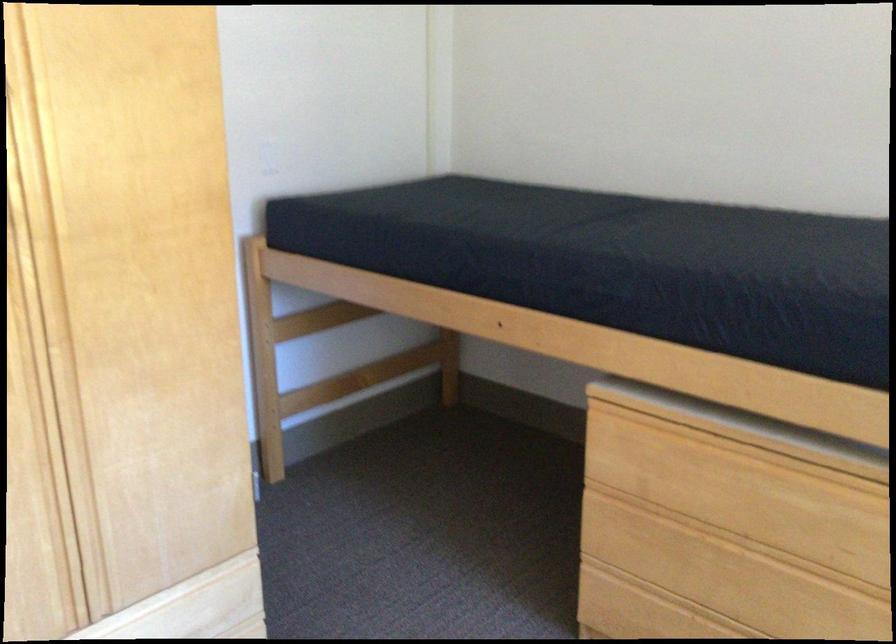
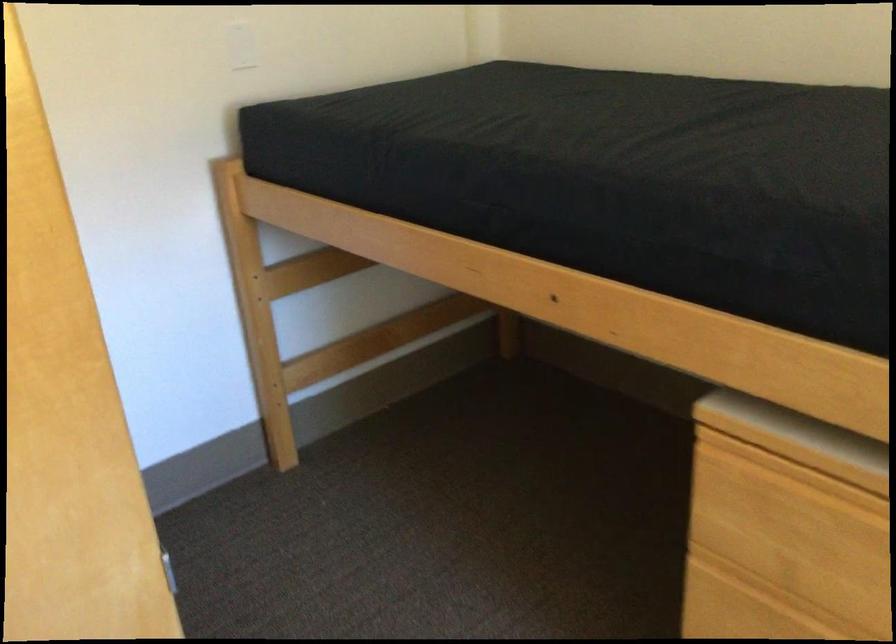
The point at (304, 323) is marked in the first image. Where is the corresponding point in the second image?

(307, 270)